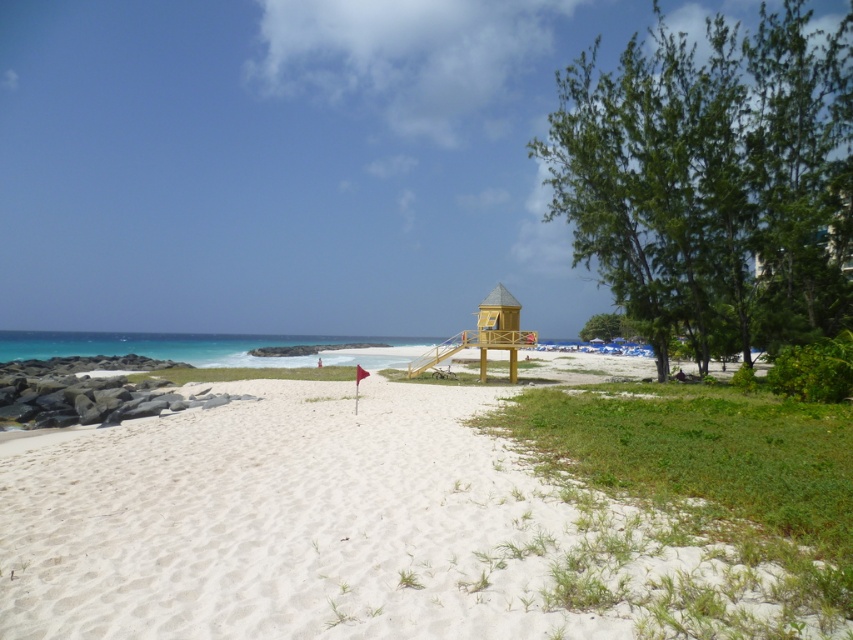
You are standing at the red flag planted in the sand near the center left of the beach scene. Looking towards the ocean, you notice a point marked at coordinates (350, 531). What is the location of this point relative to the white sandy beach at center?

The point at (350, 531) is located at the white sandy beach at center.

You are a beachgoer planning to set up your umbrella. You have two options for locations based on the objects in the scene. The first option is near the white sandy beach at center, and the second is near the green leafy tree at right. Which location has more space for your umbrella setup?

The green leafy tree at right has more space for your umbrella setup because the white sandy beach at center is thinner than the green leafy tree at right, indicating it has a narrower area.